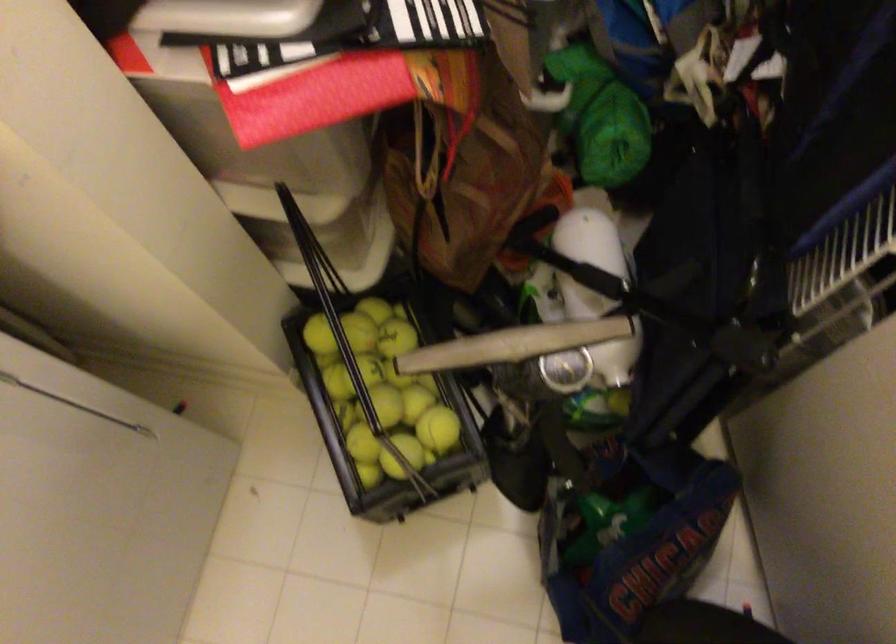
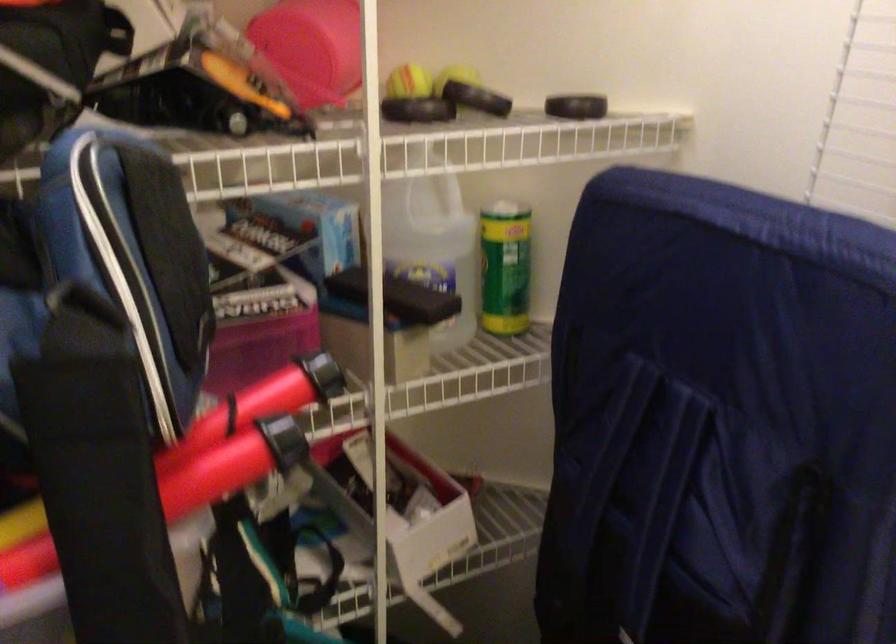
First-person continuous shooting, in which direction is the camera rotating?

The camera rotated toward right-up.